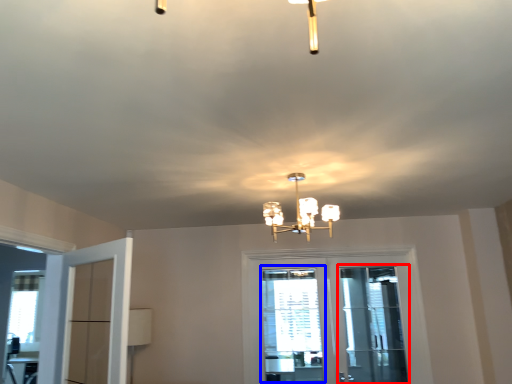
Question: Among these objects, which one is farthest to the camera, screen door (highlighted by a red box) or window (highlighted by a blue box)?

Choices:
 (A) screen door
 (B) window

Answer: (B)